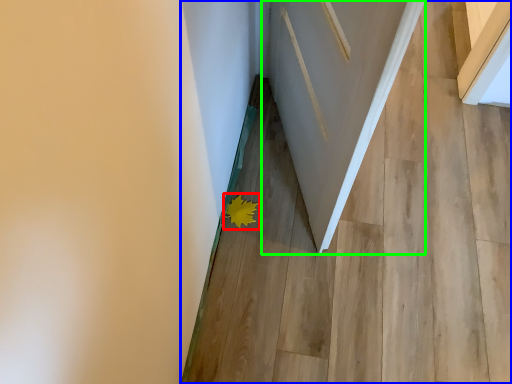
Question: Which is nearer to the flower (highlighted by a red box)? stairwell (highlighted by a blue box) or door (highlighted by a green box).

Choices:
 (A) stairwell
 (B) door

Answer: (A)